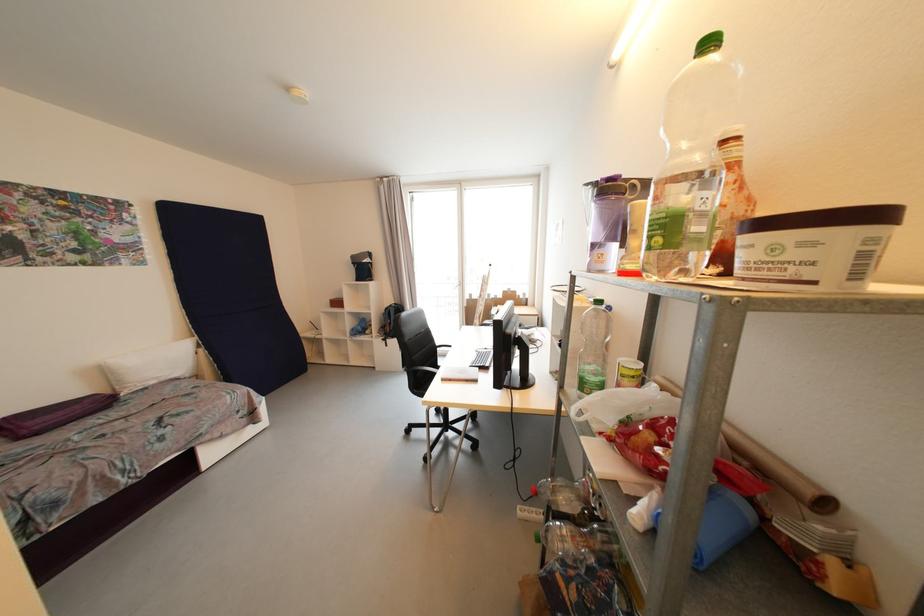
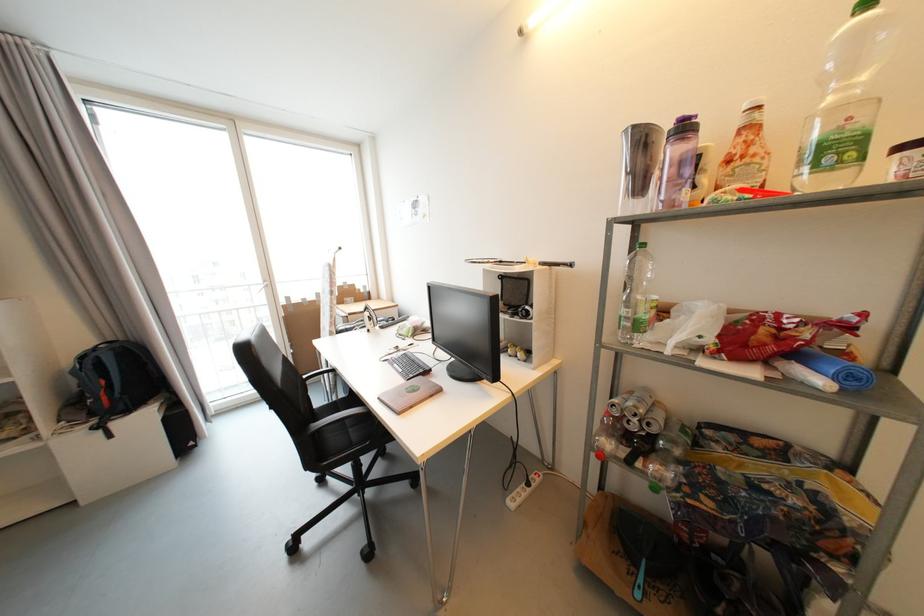
Question: The images are taken continuously from a first-person perspective. In which direction is your viewpoint rotating?

Choices:
 (A) Left
 (B) Right
 (C) Up
 (D) Down

Answer: (B)